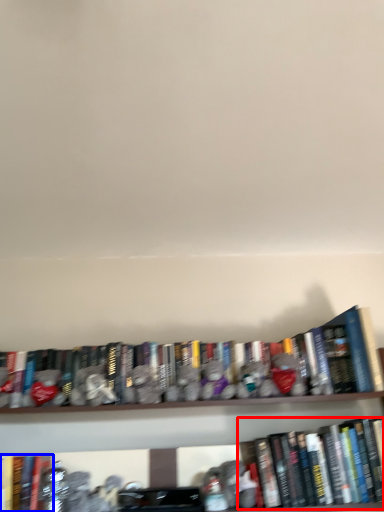
Question: Which object appears farthest to the camera in this image, book (highlighted by a red box) or book (highlighted by a blue box)?

Choices:
 (A) book
 (B) book

Answer: (A)